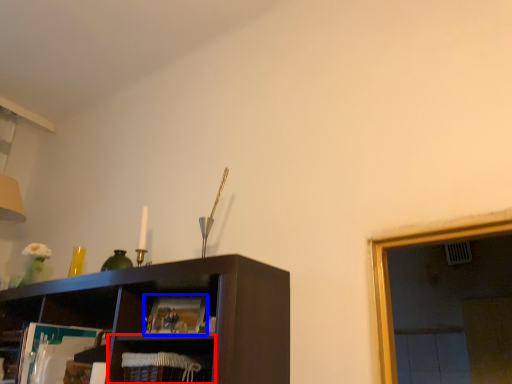
Question: Which object is further to the camera taking this photo, cabinet (highlighted by a red box) or magazine (highlighted by a blue box)?

Choices:
 (A) cabinet
 (B) magazine

Answer: (B)